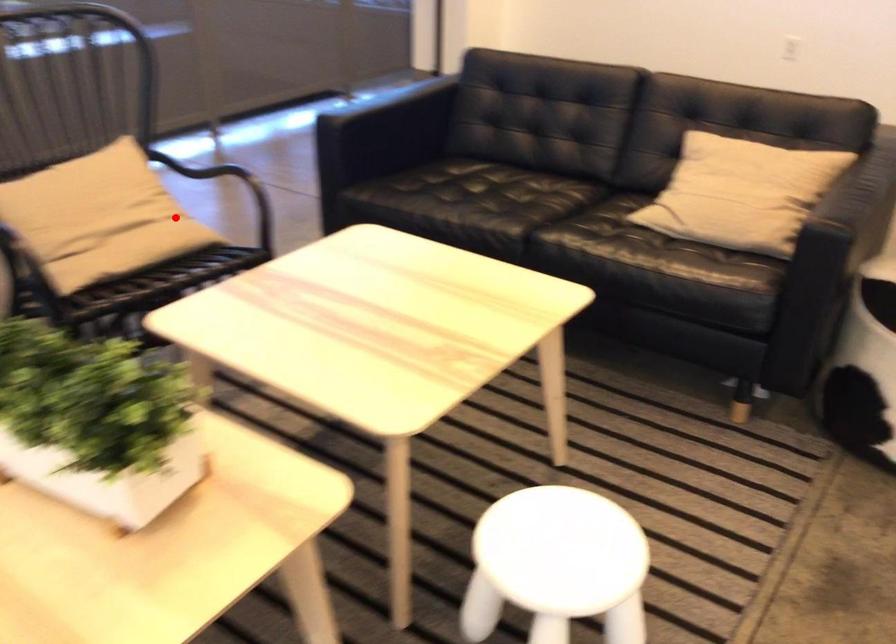
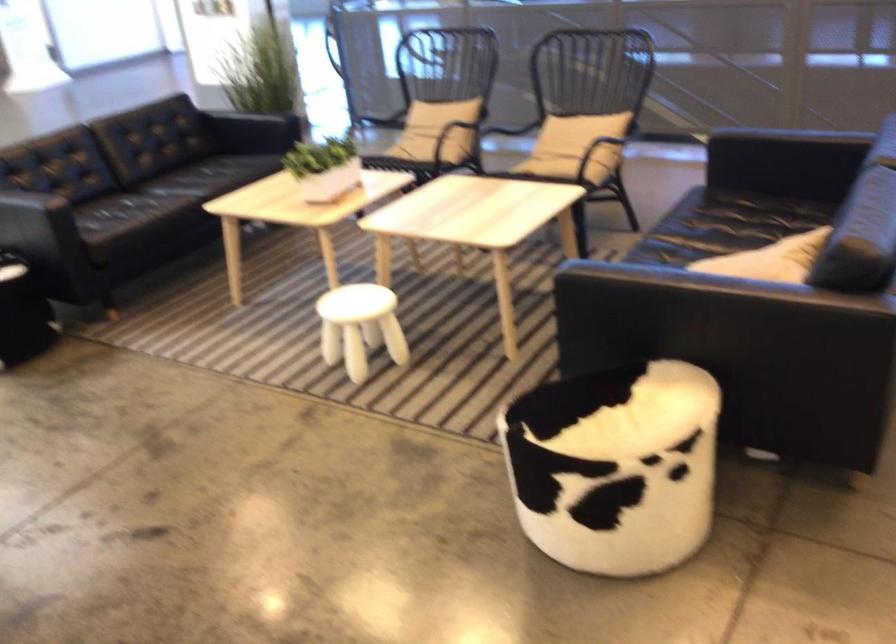
Question: I am providing you with two images of the same scene from different viewpoints. Given a red point in image1, look at the same physical point in image2. Is it:

Choices:
 (A) Closer to the viewpoint
 (B) Farther from the viewpoint

Answer: (B)